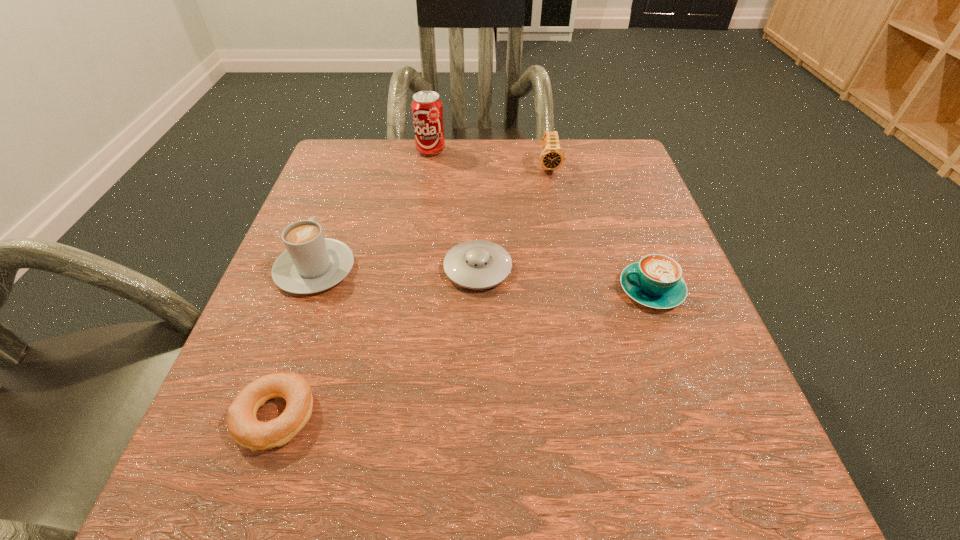
Find the location of a particular element. Image resolution: width=960 pixels, height=540 pixels. vacant space at the far right corner of the desktop is located at coordinates (604, 169).

At what (x,y) coordinates should I click in order to perform the action: click on vacant area that lies between the soda and the watch. Please return your answer as a coordinate pair (x, y). Looking at the image, I should click on (490, 159).

This screenshot has width=960, height=540. I want to click on free space between the bagel and the saucer, so click(376, 343).

Identify the location of free area in between the rightmost object and the fifth object from left to right. (600, 228).

Identify the location of free spot between the watch and the bagel. The width and height of the screenshot is (960, 540). (412, 292).

Locate an element on the screen. The image size is (960, 540). empty location between the left cappuccino and the soda is located at coordinates pos(372,210).

What are the coordinates of `unoccupied position between the third object from right to left and the third object from left to right` in the screenshot? It's located at (454, 210).

The width and height of the screenshot is (960, 540). Find the location of `vacant point located between the fourth object from left to right and the third shortest object`. vacant point located between the fourth object from left to right and the third shortest object is located at coordinates (564, 279).

Find the location of a particular element. free space between the bagel and the left cappuccino is located at coordinates 295,343.

In order to click on vacant space in between the fourth object from right to left and the rightmost object in this screenshot , I will do `click(541, 220)`.